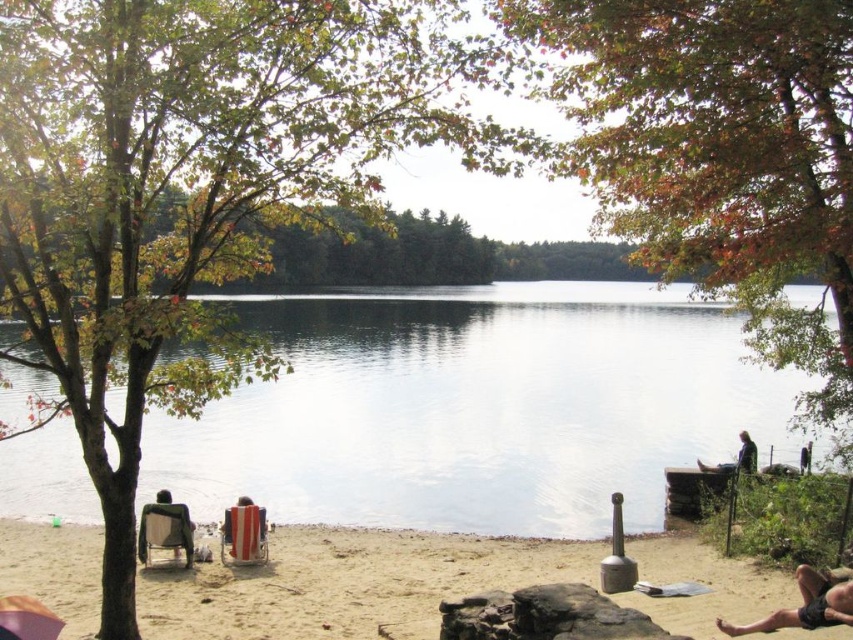
Is the position of striped fabric beach chair at lower left more distant than that of dark gray fabric chair at lower right?

No, it is in front of dark gray fabric chair at lower right.

Image resolution: width=853 pixels, height=640 pixels. Describe the element at coordinates (242, 534) in the screenshot. I see `striped fabric beach chair at lower left` at that location.

Where is `striped fabric beach chair at lower left`? striped fabric beach chair at lower left is located at coordinates point(242,534).

The height and width of the screenshot is (640, 853). What do you see at coordinates (165, 531) in the screenshot?
I see `metallic silver beach chair at lower left` at bounding box center [165, 531].

Who is more distant from viewer, (154, 541) or (251, 509)?

Point (251, 509)

Identify the location of metallic silver beach chair at lower left. The width and height of the screenshot is (853, 640). (165, 531).

Is green leafy tree at upper left taller than dark gray fabric chair at lower right?

In fact, green leafy tree at upper left may be shorter than dark gray fabric chair at lower right.

Which is more to the right, green leafy tree at upper left or dark gray fabric chair at lower right?

dark gray fabric chair at lower right is more to the right.

Is point (299, 10) less distant than point (749, 458)?

Yes.

You are a GUI agent. You are given a task and a screenshot of the screen. Output one action in this format:
    pyautogui.click(x=<x>, y=<y>)
    Task: Click on the green leafy tree at upper left
    
    Given the screenshot: What is the action you would take?
    pyautogui.click(x=198, y=188)